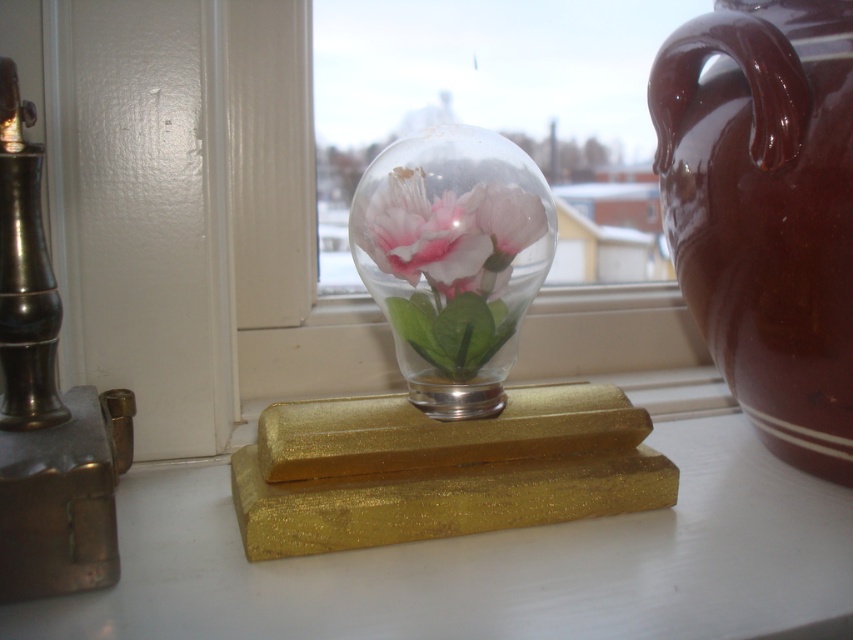
Question: Can you confirm if burgundy ceramic vase at right is positioned above pink matte flower at center?

Choices:
 (A) yes
 (B) no

Answer: (B)

Question: Which object is positioned closest to the gold glittery counter top at center?

Choices:
 (A) burgundy ceramic vase at right
 (B) transparent glass vase at center

Answer: (B)

Question: Which point is closer to the camera?

Choices:
 (A) (490, 228)
 (B) (701, 125)

Answer: (A)

Question: Which object is farther from the camera taking this photo?

Choices:
 (A) gold glittery counter top at center
 (B) pink matte flower at center
 (C) burgundy ceramic vase at right
 (D) transparent glass vase at center

Answer: (C)

Question: Does gold glittery counter top at center appear under burgundy ceramic vase at right?

Choices:
 (A) no
 (B) yes

Answer: (B)

Question: Is burgundy ceramic vase at right closer to camera compared to transparent glass vase at center?

Choices:
 (A) no
 (B) yes

Answer: (A)